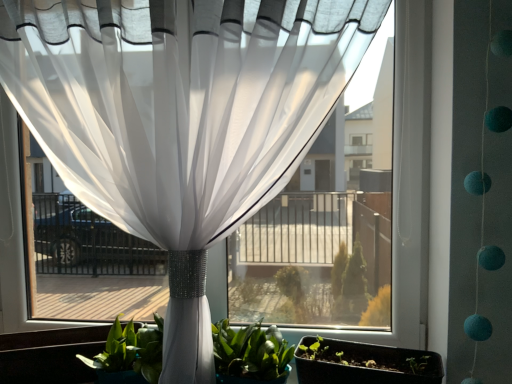
The height and width of the screenshot is (384, 512). I want to click on matte black flowerpot at lower right, so click(x=365, y=364).

Describe the element at coordinates (365, 364) in the screenshot. The height and width of the screenshot is (384, 512). I see `matte black flowerpot at lower right` at that location.

Describe the element at coordinates (252, 355) in the screenshot. Image resolution: width=512 pixels, height=384 pixels. I see `green leafy plant at center` at that location.

This screenshot has height=384, width=512. Identify the location of green leafy plant at center. (252, 355).

Locate an element on the screen. matte black flowerpot at lower right is located at coordinates (365, 364).

Is green leafy plant at center to the right of matte black flowerpot at lower right from the viewer's perspective?

In fact, green leafy plant at center is to the left of matte black flowerpot at lower right.

Which object is closer to the camera, green leafy plant at center or matte black flowerpot at lower right?

matte black flowerpot at lower right is more forward.

Which is behind, point (120, 359) or point (371, 355)?

The point (371, 355) is behind.

From the image's perspective, is green leafy plant at center positioned above or below matte black flowerpot at lower right?

green leafy plant at center is above matte black flowerpot at lower right.

From a real-world perspective, is green leafy plant at center located beneath matte black flowerpot at lower right?

No.

Considering the sizes of green leafy plant at center and matte black flowerpot at lower right in the image, is green leafy plant at center wider or thinner than matte black flowerpot at lower right?

In the image, green leafy plant at center appears to be wider than matte black flowerpot at lower right.

Is green leafy plant at center taller than matte black flowerpot at lower right?

Yes.

Between green leafy plant at center and matte black flowerpot at lower right, which one has larger size?

With larger size is green leafy plant at center.

Is green leafy plant at center outside of matte black flowerpot at lower right?

That's correct, green leafy plant at center is outside of matte black flowerpot at lower right.

Is green leafy plant at center not close to matte black flowerpot at lower right?

No.

Is green leafy plant at center facing towards matte black flowerpot at lower right?

No, green leafy plant at center is not oriented towards matte black flowerpot at lower right.

Can you tell me how much green leafy plant at center and matte black flowerpot at lower right differ in facing direction?

There is a 12.4-degree angle between the facing directions of green leafy plant at center and matte black flowerpot at lower right.

In the scene shown: Measure the distance between green leafy plant at center and matte black flowerpot at lower right.

green leafy plant at center is 25.10 centimeters away from matte black flowerpot at lower right.

Find the location of a particular element. This screenshot has height=384, width=512. houseplant above the matte black flowerpot at lower right (from the image's perspective) is located at coordinates (252, 355).

Is matte black flowerpot at lower right to the left of green leafy plant at center from the viewer's perspective?

Incorrect, matte black flowerpot at lower right is not on the left side of green leafy plant at center.

Is the depth of matte black flowerpot at lower right greater than that of green leafy plant at center?

No, matte black flowerpot at lower right is closer to the viewer.

Considering the positions of points (362, 372) and (95, 361), is point (362, 372) farther from camera compared to point (95, 361)?

No, (362, 372) is in front of (95, 361).

From the image's perspective, between matte black flowerpot at lower right and green leafy plant at center, who is located below?

From the image's view, matte black flowerpot at lower right is below.

From a real-world perspective, is matte black flowerpot at lower right above or below green leafy plant at center?

From a real-world perspective, matte black flowerpot at lower right is physically below green leafy plant at center.

Looking at this image, which of these two, matte black flowerpot at lower right or green leafy plant at center, is thinner?

matte black flowerpot at lower right.

Between matte black flowerpot at lower right and green leafy plant at center, which one has less height?

matte black flowerpot at lower right is shorter.

Can you confirm if matte black flowerpot at lower right is smaller than green leafy plant at center?

Indeed, matte black flowerpot at lower right has a smaller size compared to green leafy plant at center.

From the picture: Can we say matte black flowerpot at lower right lies outside green leafy plant at center?

Yes, matte black flowerpot at lower right is located beyond the bounds of green leafy plant at center.

Is matte black flowerpot at lower right directly adjacent to green leafy plant at center?

No, matte black flowerpot at lower right is not with green leafy plant at center.

Is matte black flowerpot at lower right oriented towards green leafy plant at center?

No.

Image resolution: width=512 pixels, height=384 pixels. I want to click on houseplant located above the matte black flowerpot at lower right (from the image's perspective), so click(252, 355).

This screenshot has width=512, height=384. There is a matte black flowerpot at lower right. Find the location of `houseplant above it (from a real-world perspective)`. houseplant above it (from a real-world perspective) is located at coordinates (252, 355).

This screenshot has height=384, width=512. I want to click on houseplant lying behind the matte black flowerpot at lower right, so click(252, 355).